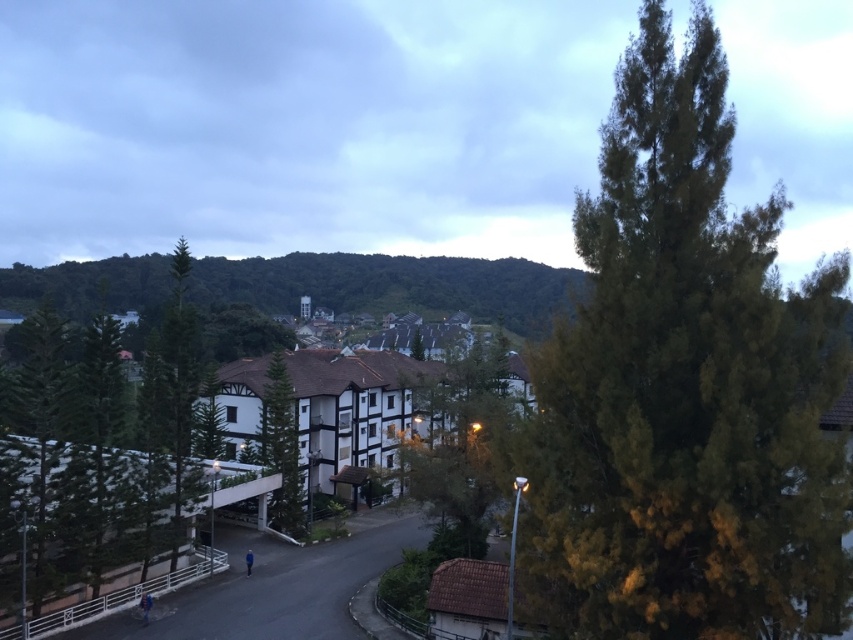
Looking at this image, you are standing at the point closer to the camera in the image. Which point are you at, point [839,460] or point [514,353]?

You are at point [839,460] because it is closer to the camera than point [514,353].

You are a hiker trying to navigate through the suburban area. You see a green leafy hill at center and a green textured tree at center. Which one is more to the right?

The green leafy hill at center is positioned on the right side of green textured tree at center, so the green leafy hill at center is more to the right.